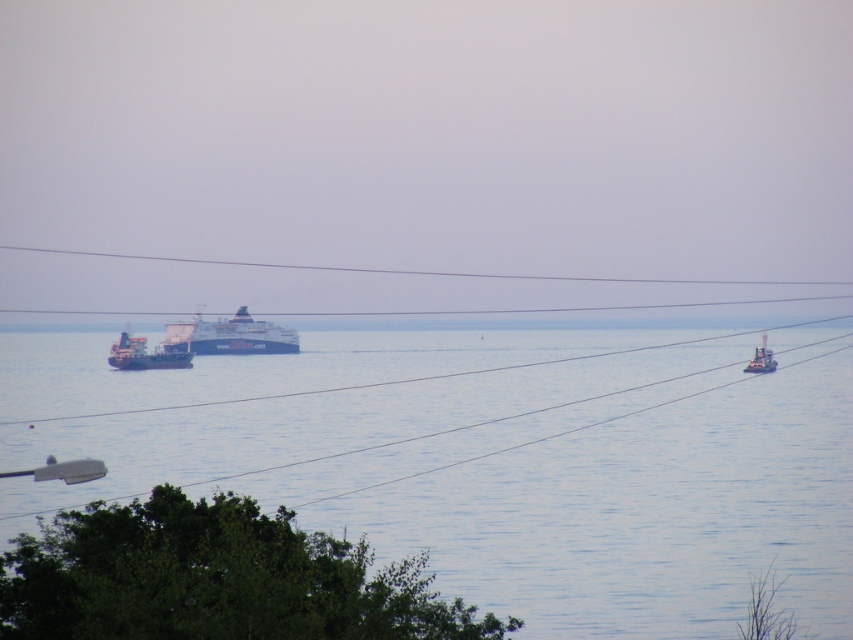
You are a drone operator trying to capture a photo of the green matte cargo ship at center from above the blue water at center. The drone has a maximum flight range of 50 meters. Can the drone reach the cargo ship from the water?

The distance between the blue water at center and the green matte cargo ship at center is 52.51 meters, which exceeds the drone maximum flight range of 50 meters. The drone cannot reach the cargo ship from the water.

Based on the photo, you are a photographer trying to capture a shot of both the green matte cargo ship at center and the metallic gray boat at right. Based on their positions, which one should you adjust your camera to focus on first if you want to include both in the frame without moving the camera?

You should focus on the metallic gray boat at right first because the green matte cargo ship at center is to the left of it, meaning the boat is closer to the right edge of the frame and might be cut off if not properly framed.

You are standing on a dock and want to throw a floating ring to someone in the water. The floating ring can travel 50 meters. Based on the scene, will the blue water at center be within reach of the floating ring?

The blue water at center is 77.87 meters away from camera. Since the floating ring can only travel 50 meters, it will not reach the blue water at center.